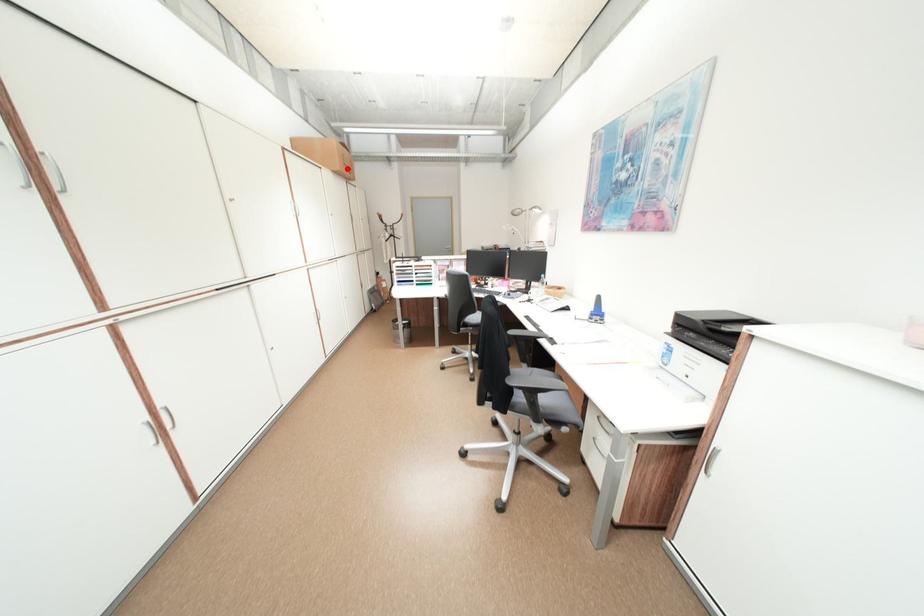
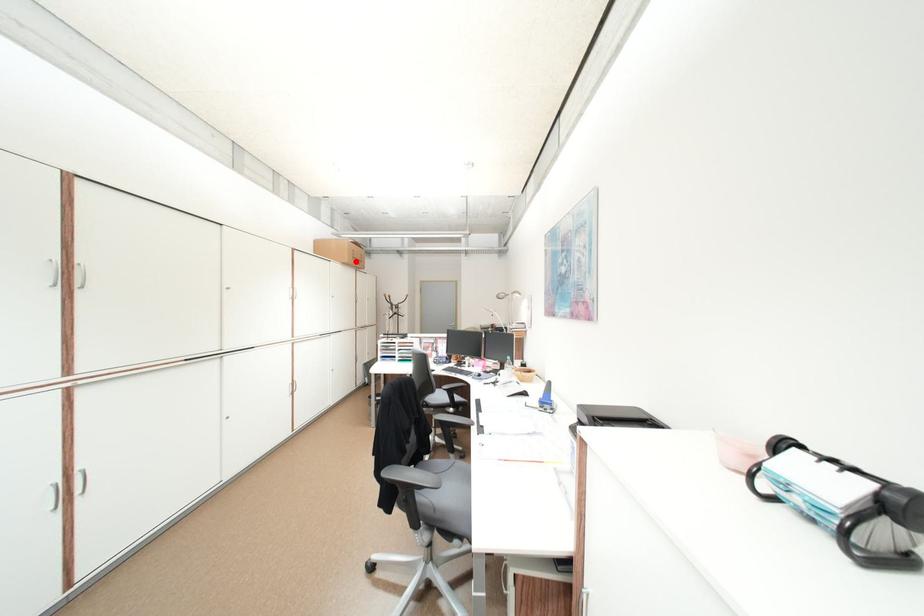
I am providing you with two images of the same scene from different viewpoints. A red point is marked on the first image and another point is marked on the second image. Is the marked point in image1 the same physical position as the marked point in image2?

Yes